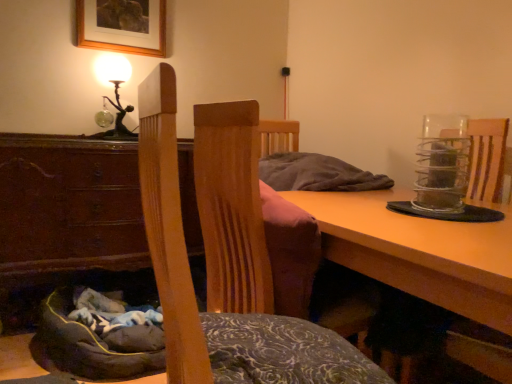
Question: Considering the positions of wooden chair at center and metallic glass table lamp at upper left in the image, is wooden chair at center bigger or smaller than metallic glass table lamp at upper left?

Choices:
 (A) big
 (B) small

Answer: (A)

Question: From the image's perspective, is wooden chair at center positioned above or below metallic glass table lamp at upper left?

Choices:
 (A) above
 (B) below

Answer: (B)

Question: Based on their relative distances, which object is farther from the brown wood cabinet at lower left?

Choices:
 (A) dark gray fabric bean bag at lower left
 (B) wooden chair at center
 (C) wooden table at lower center
 (D) wooden picture frame at upper center
 (E) metallic glass table lamp at upper left

Answer: (C)

Question: Which object is positioned closest to the wooden chair at center?

Choices:
 (A) wooden table at lower center
 (B) metallic glass table lamp at upper left
 (C) wooden picture frame at upper center
 (D) dark gray fabric bean bag at lower left
 (E) brown wood cabinet at lower left

Answer: (A)